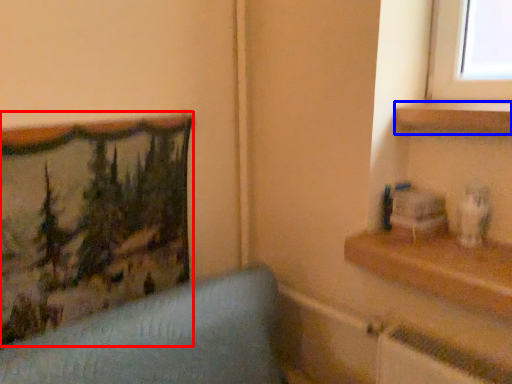
Question: Which of the following is the closest to the observer, picture frame (highlighted by a red box) or shelf (highlighted by a blue box)?

Choices:
 (A) picture frame
 (B) shelf

Answer: (A)